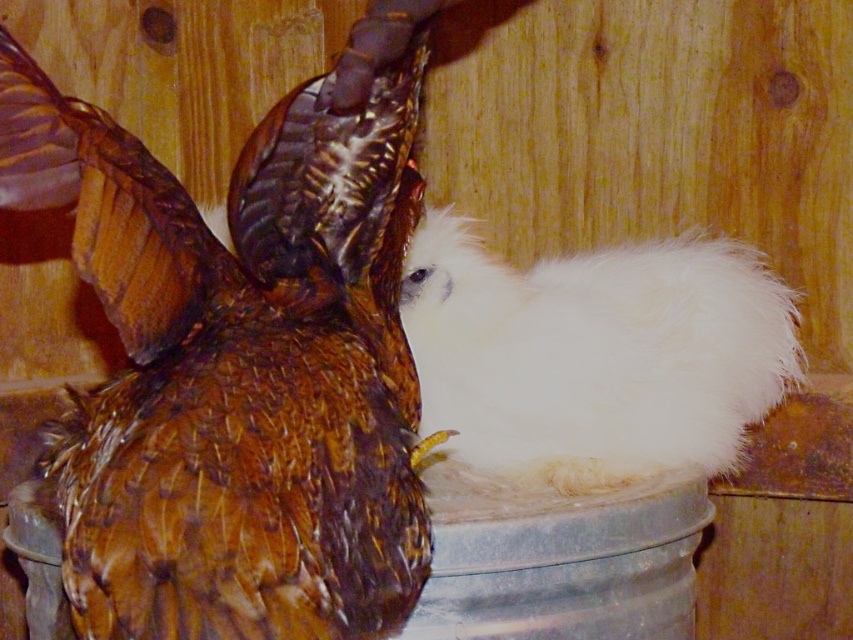
Does brown feathered chicken at upper left appear over white fluffy chicken at center?

Indeed, brown feathered chicken at upper left is positioned over white fluffy chicken at center.

Is brown feathered chicken at upper left closer to the viewer compared to white fluffy chicken at center?

Yes, brown feathered chicken at upper left is closer to the viewer.

The height and width of the screenshot is (640, 853). Describe the element at coordinates (236, 369) in the screenshot. I see `brown feathered chicken at upper left` at that location.

Image resolution: width=853 pixels, height=640 pixels. Find the location of `brown feathered chicken at upper left`. brown feathered chicken at upper left is located at coordinates (236, 369).